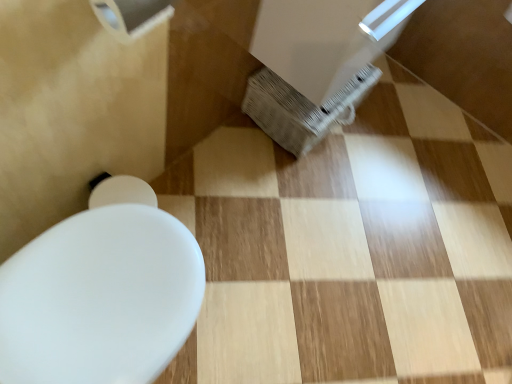
This screenshot has width=512, height=384. Identify the location of white glossy toilet at lower left. (101, 293).

What do you see at coordinates (101, 293) in the screenshot? The width and height of the screenshot is (512, 384). I see `white glossy toilet at lower left` at bounding box center [101, 293].

The width and height of the screenshot is (512, 384). Find the location of `white glossy toilet at lower left`. white glossy toilet at lower left is located at coordinates (101, 293).